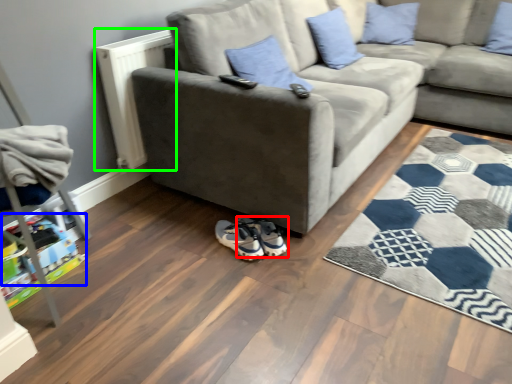
Question: Considering the real-world distances, which object is farthest from footwear (highlighted by a red box)? toy (highlighted by a blue box) or radiator (highlighted by a green box)?

Choices:
 (A) toy
 (B) radiator

Answer: (B)